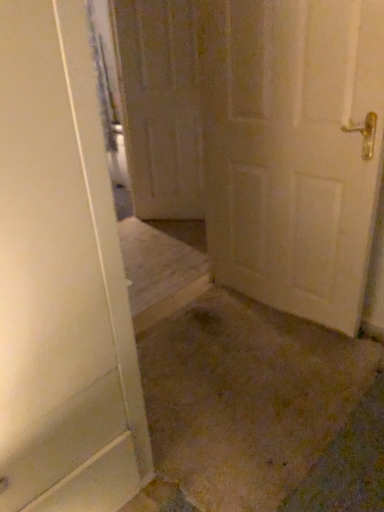
Measure the distance between point (176, 196) and camera.

Point (176, 196) and camera are 3.35 meters apart from each other.

This screenshot has width=384, height=512. Describe the element at coordinates (159, 106) in the screenshot. I see `wooden door at center, acting as the first door starting from the back` at that location.

How much space does wooden door at center, which is counted as the 2th door, starting from the front, occupy vertically?

1.52 meters.

Locate an element on the screen. wooden door at center, acting as the first door starting from the back is located at coordinates (159, 106).

Identify the location of white matte door at center, placed as the 1th door when sorted from front to back. Image resolution: width=384 pixels, height=512 pixels. (293, 150).

Image resolution: width=384 pixels, height=512 pixels. Describe the element at coordinates (293, 150) in the screenshot. I see `white matte door at center, arranged as the 1th door when viewed from the right` at that location.

In order to click on wooden door at center, which is counted as the 2th door, starting from the front in this screenshot , I will do `click(159, 106)`.

From the picture: Visually, is wooden door at center, which is the first door from left to right, positioned to the left or to the right of white matte door at center, placed as the 1th door when sorted from front to back?

In the image, wooden door at center, which is the first door from left to right, appears on the left side of white matte door at center, placed as the 1th door when sorted from front to back.

Who is more distant, wooden door at center, which is counted as the 2th door, starting from the front, or white matte door at center, the 2th door when ordered from left to right?

wooden door at center, which is counted as the 2th door, starting from the front, is behind.

Which is nearer, (192, 30) or (298, 220)?

Point (192, 30) is positioned farther from the camera compared to point (298, 220).

From the image's perspective, between wooden door at center, marked as the 2th door in a right-to-left arrangement, and white matte door at center, marked as the second door in a back-to-front arrangement, which one is located above?

wooden door at center, marked as the 2th door in a right-to-left arrangement, is shown above in the image.

From a real-world perspective, is wooden door at center, marked as the 2th door in a right-to-left arrangement, above or below white matte door at center, marked as the second door in a back-to-front arrangement?

Clearly, from a real-world perspective, wooden door at center, marked as the 2th door in a right-to-left arrangement, is above white matte door at center, marked as the second door in a back-to-front arrangement.

Is wooden door at center, acting as the first door starting from the back, wider or thinner than white matte door at center, arranged as the 1th door when viewed from the right?

Clearly, wooden door at center, acting as the first door starting from the back, has less width compared to white matte door at center, arranged as the 1th door when viewed from the right.

Is wooden door at center, marked as the 2th door in a right-to-left arrangement, taller than white matte door at center, the 2th door when ordered from left to right?

Yes, wooden door at center, marked as the 2th door in a right-to-left arrangement, is taller than white matte door at center, the 2th door when ordered from left to right.

Considering the relative sizes of wooden door at center, marked as the 2th door in a right-to-left arrangement, and white matte door at center, placed as the 1th door when sorted from front to back, in the image provided, is wooden door at center, marked as the 2th door in a right-to-left arrangement, smaller than white matte door at center, placed as the 1th door when sorted from front to back,?

Yes, wooden door at center, marked as the 2th door in a right-to-left arrangement, is smaller than white matte door at center, placed as the 1th door when sorted from front to back.

Looking at this image, is wooden door at center, which is the first door from left to right, completely or partially outside of white matte door at center, arranged as the 1th door when viewed from the right?

Yes, wooden door at center, which is the first door from left to right, is outside of white matte door at center, arranged as the 1th door when viewed from the right.

Is wooden door at center, marked as the 2th door in a right-to-left arrangement, far away from white matte door at center, the 2th door when ordered from left to right?

Yes.

Is wooden door at center, which is counted as the 2th door, starting from the front, looking in the opposite direction of white matte door at center, the 2th door when ordered from left to right?

No.

Where is `door that is under the wooden door at center, acting as the first door starting from the back (from a real-world perspective)`? The width and height of the screenshot is (384, 512). door that is under the wooden door at center, acting as the first door starting from the back (from a real-world perspective) is located at coordinates (293, 150).

Considering the relative positions of white matte door at center, the 2th door when ordered from left to right, and wooden door at center, marked as the 2th door in a right-to-left arrangement, in the image provided, is white matte door at center, the 2th door when ordered from left to right, to the left of wooden door at center, marked as the 2th door in a right-to-left arrangement, from the viewer's perspective?

No, white matte door at center, the 2th door when ordered from left to right, is not to the left of wooden door at center, marked as the 2th door in a right-to-left arrangement.

Considering their positions, is white matte door at center, marked as the second door in a back-to-front arrangement, located in front of or behind wooden door at center, acting as the first door starting from the back?

white matte door at center, marked as the second door in a back-to-front arrangement, is in front of wooden door at center, acting as the first door starting from the back.

Looking at this image, which is closer, [377,113] or [194,62]?

Point [377,113] is closer to the camera than point [194,62].

From the image's perspective, would you say white matte door at center, marked as the second door in a back-to-front arrangement, is positioned over wooden door at center, marked as the 2th door in a right-to-left arrangement?

Incorrect, from the image's perspective, white matte door at center, marked as the second door in a back-to-front arrangement, is lower than wooden door at center, marked as the 2th door in a right-to-left arrangement.

Looking at this image, from a real-world perspective, between white matte door at center, placed as the 1th door when sorted from front to back, and wooden door at center, marked as the 2th door in a right-to-left arrangement, who is vertically higher?

wooden door at center, marked as the 2th door in a right-to-left arrangement, is physically above.

Does white matte door at center, the 2th door when ordered from left to right, have a greater width compared to wooden door at center, marked as the 2th door in a right-to-left arrangement?

Yes.

Who is taller, white matte door at center, marked as the second door in a back-to-front arrangement, or wooden door at center, acting as the first door starting from the back?

wooden door at center, acting as the first door starting from the back, is taller.

Considering the sizes of white matte door at center, placed as the 1th door when sorted from front to back, and wooden door at center, which is the first door from left to right, in the image, is white matte door at center, placed as the 1th door when sorted from front to back, bigger or smaller than wooden door at center, which is the first door from left to right,?

In the image, white matte door at center, placed as the 1th door when sorted from front to back, appears to be larger than wooden door at center, which is the first door from left to right.

Could wooden door at center, acting as the first door starting from the back, be considered to be inside white matte door at center, marked as the second door in a back-to-front arrangement?

No, white matte door at center, marked as the second door in a back-to-front arrangement, does not contain wooden door at center, acting as the first door starting from the back.

Are white matte door at center, placed as the 1th door when sorted from front to back, and wooden door at center, which is the first door from left to right, beside each other?

They are not placed beside each other.

Is white matte door at center, marked as the second door in a back-to-front arrangement, facing away from wooden door at center, which is counted as the 2th door, starting from the front?

white matte door at center, marked as the second door in a back-to-front arrangement, does not have its back to wooden door at center, which is counted as the 2th door, starting from the front.

Can you tell me how much white matte door at center, placed as the 1th door when sorted from front to back, and wooden door at center, marked as the 2th door in a right-to-left arrangement, differ in facing direction?

white matte door at center, placed as the 1th door when sorted from front to back, and wooden door at center, marked as the 2th door in a right-to-left arrangement, are facing 40.5 degrees away from each other.

How distant is white matte door at center, the 2th door when ordered from left to right, from wooden door at center, marked as the 2th door in a right-to-left arrangement?

white matte door at center, the 2th door when ordered from left to right, is 1.26 meters from wooden door at center, marked as the 2th door in a right-to-left arrangement.

I want to click on door above the white matte door at center, placed as the 1th door when sorted from front to back (from the image's perspective), so click(159, 106).

Locate an element on the screen. The width and height of the screenshot is (384, 512). door that appears on the right of wooden door at center, which is counted as the 2th door, starting from the front is located at coordinates (293, 150).

This screenshot has height=512, width=384. Find the location of `door on the left side of white matte door at center, arranged as the 1th door when viewed from the right`. door on the left side of white matte door at center, arranged as the 1th door when viewed from the right is located at coordinates (159, 106).